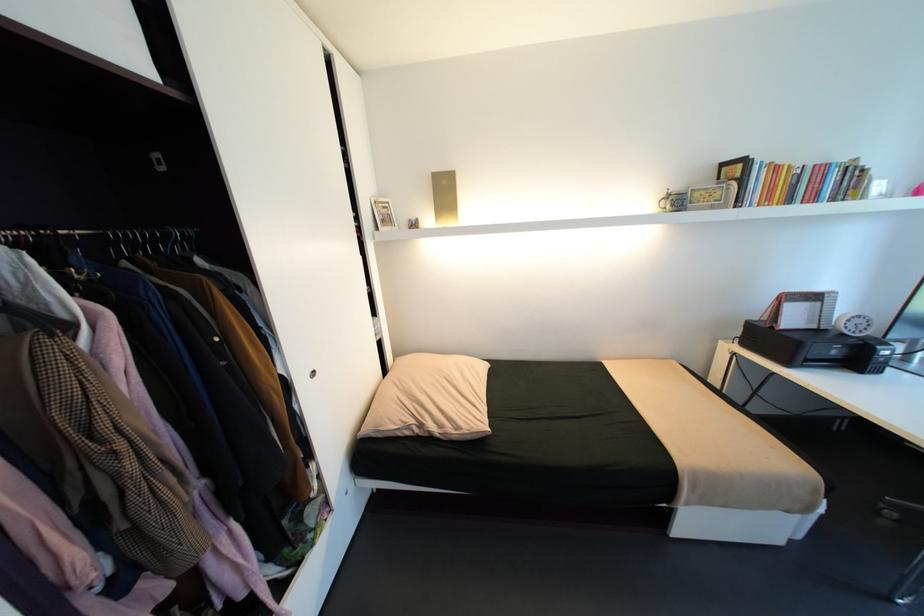
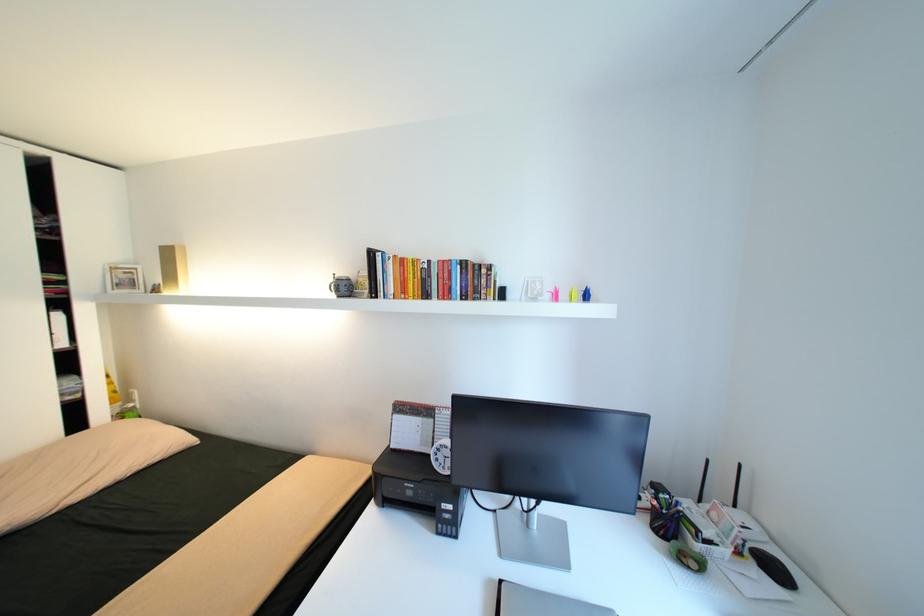
Question: I am providing you with two images of the same scene from different viewpoints. After the viewpoint changes to image2, which objects are now occluded?

Choices:
 (A) blue origami crane
 (B) pink origami crane
 (C) laptop lid
 (D) none of these

Answer: (D)